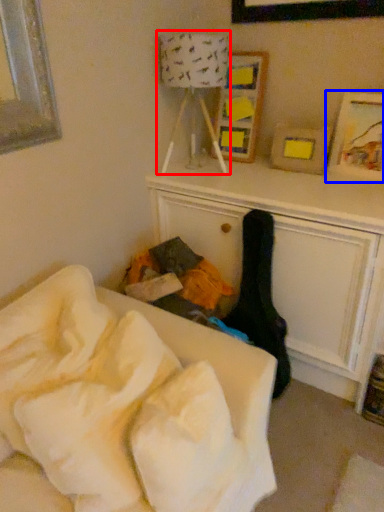
Question: Which point is further to the camera, lamp (highlighted by a red box) or picture frame (highlighted by a blue box)?

Choices:
 (A) lamp
 (B) picture frame

Answer: (B)